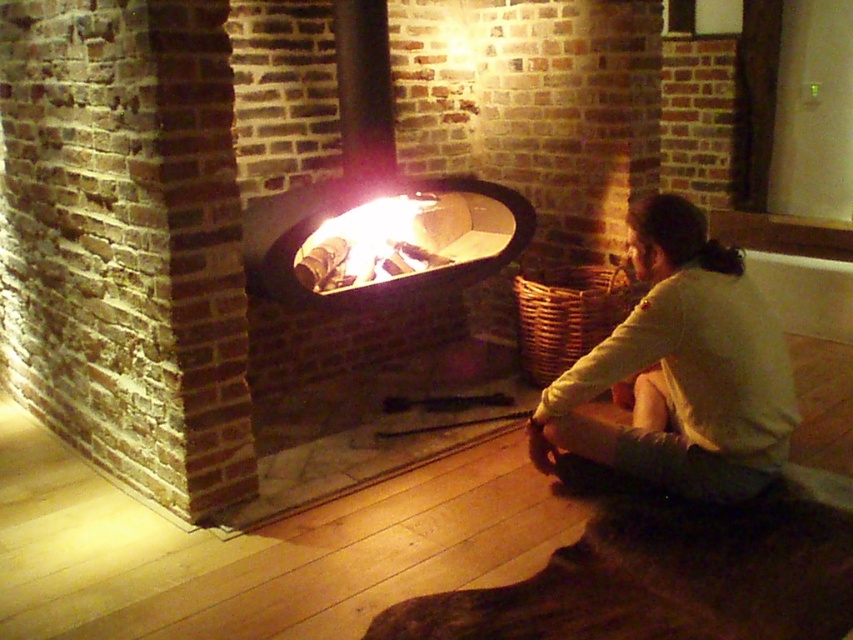
You are a safety inspector checking the scene. The safety guidelines state that flammable materials must be kept at least 5 feet away from open flames. Are the light beige cotton shirt at lower right and the charcoal wood fire at center compliant with this requirement?

The light beige cotton shirt at lower right and the charcoal wood fire at center are 4.34 feet apart from each other, which is less than the required 5 feet. Therefore, they are not compliant with the safety guidelines.

You are standing in the room and want to place a decorative item exactly at the center of the room. The room has a smooth black fire pit at center. Can you place the item at the center without moving the fire pit?

The smooth black fire pit at center is already located at the center of the room, so you cannot place another item there without moving it.